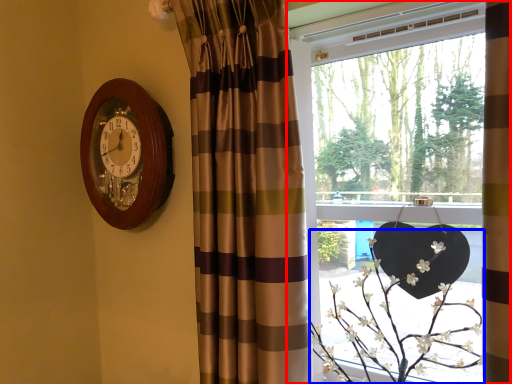
Question: Which object appears farthest to the camera in this image, window (highlighted by a red box) or floral arrangement (highlighted by a blue box)?

Choices:
 (A) window
 (B) floral arrangement

Answer: (B)